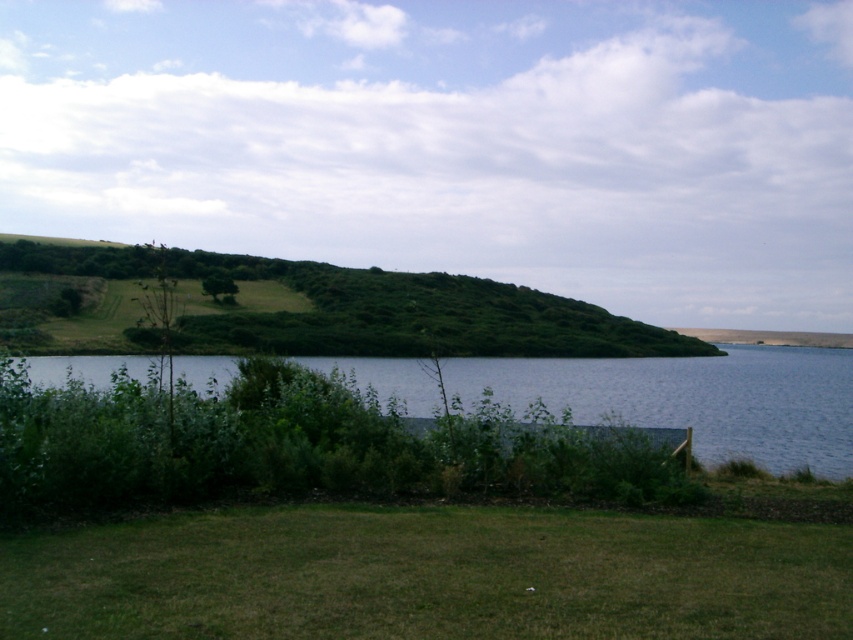
Is point (535, 380) farther from camera compared to point (428, 275)?

No, (535, 380) is closer to viewer.

I want to click on blue water at center, so click(x=693, y=397).

Does point (106, 372) come farther from viewer compared to point (141, 256)?

No.

Where is `blue water at center`? The image size is (853, 640). blue water at center is located at coordinates (693, 397).

What do you see at coordinates (427, 576) in the screenshot? The width and height of the screenshot is (853, 640). I see `green grassy field at lower center` at bounding box center [427, 576].

Can you confirm if green grassy field at lower center is positioned below blue water at center?

Actually, green grassy field at lower center is above blue water at center.

Where is `green grassy field at lower center`? The image size is (853, 640). green grassy field at lower center is located at coordinates (427, 576).

Where is `green grassy field at lower center`? The width and height of the screenshot is (853, 640). green grassy field at lower center is located at coordinates (x=427, y=576).

Who is positioned more to the right, green grassy field at lower center or green grassy hillside at upper left?

green grassy field at lower center

In order to click on green grassy field at lower center in this screenshot , I will do `click(427, 576)`.